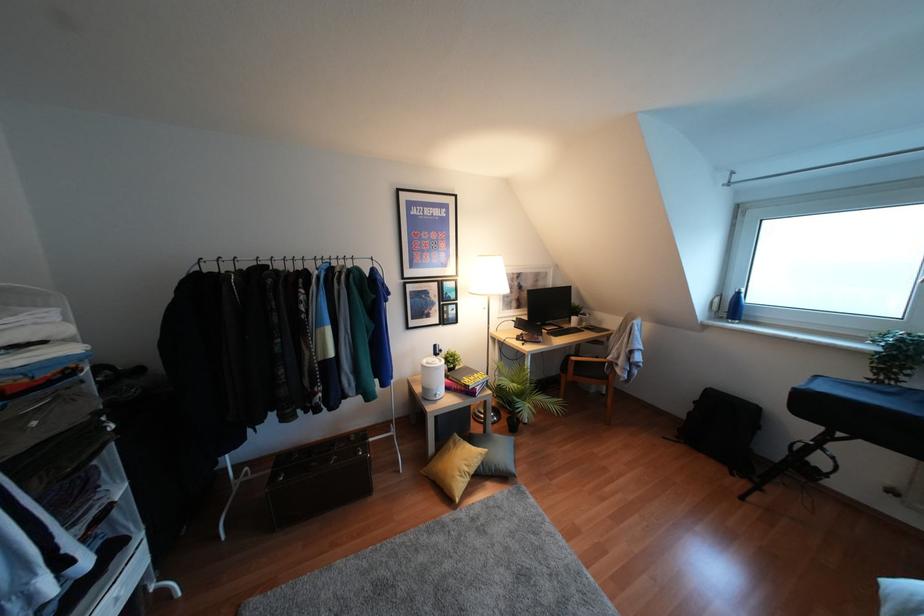
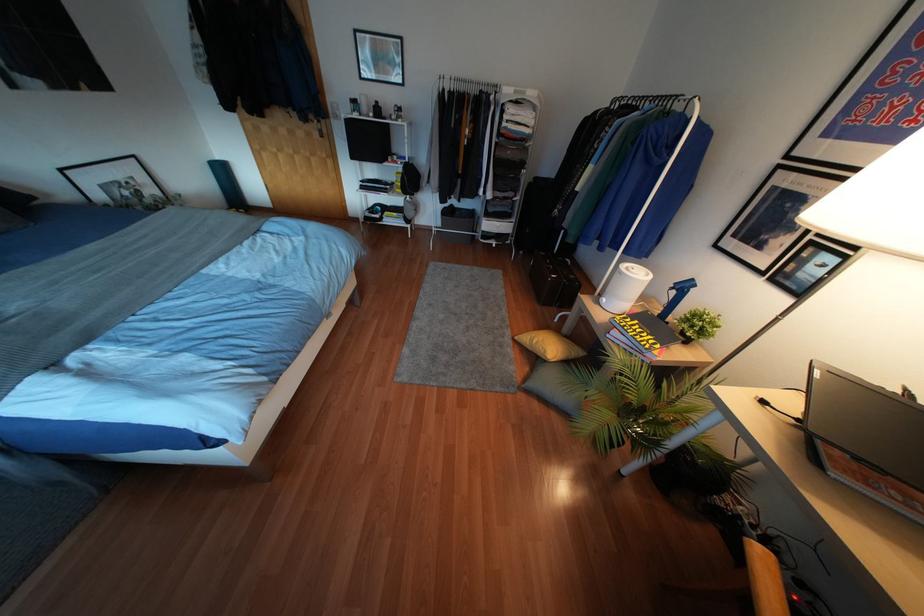
Locate, in the second image, the point that corresponds to pixel 466 469 in the first image.

(533, 341)